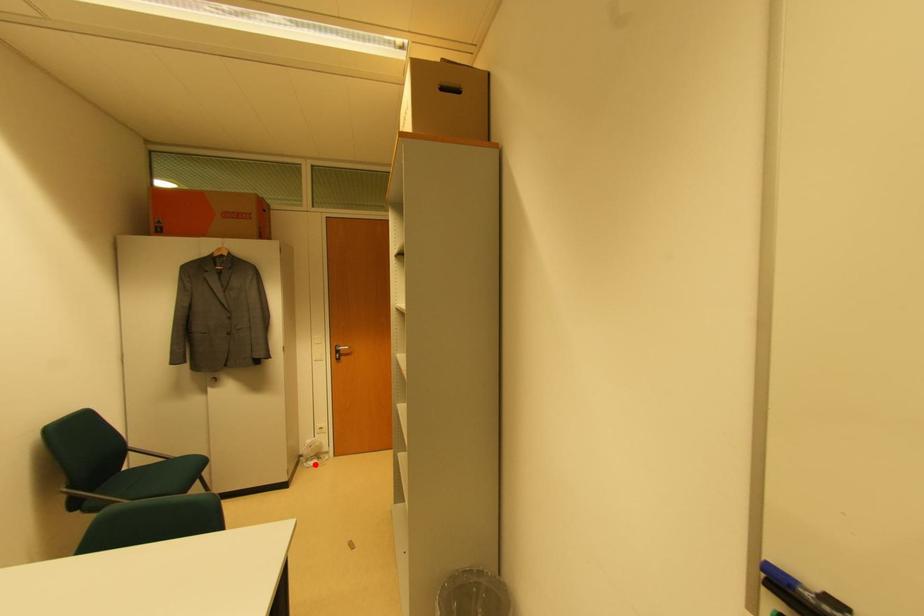
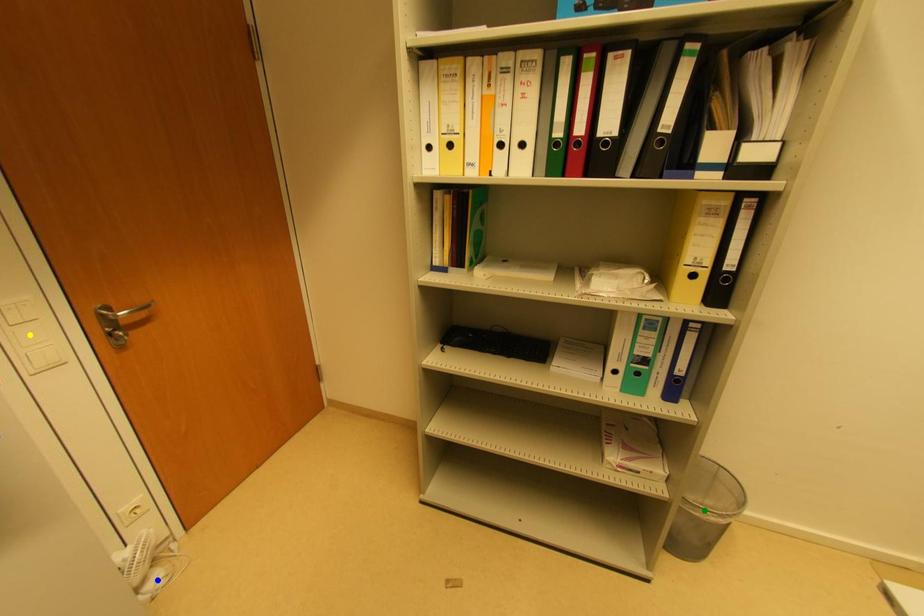
Question: I am providing you with two images of the same scene from different viewpoints. A red point is marked on the first image. You are given multiple points on the second image. Which point in image 2 is actually the same real-world point as the red point in image 1?

Choices:
 (A) blue point
 (B) green point
 (C) yellow point

Answer: (A)